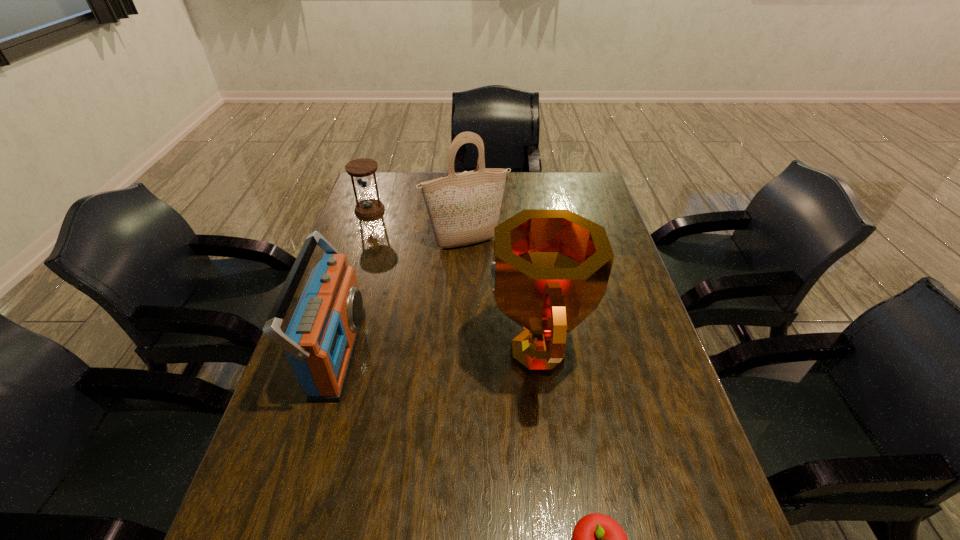
At what (x,y) coordinates should I click in order to perform the action: click on the fourth nearest object. Please return your answer as a coordinate pair (x, y). The image size is (960, 540). Looking at the image, I should click on (464, 208).

Identify the location of award. This screenshot has width=960, height=540. (550, 270).

Identify the location of radio receiver. (320, 340).

I want to click on the farthest object, so click(368, 207).

Locate an element on the screen. The width and height of the screenshot is (960, 540). the second shortest object is located at coordinates (368, 207).

I want to click on free spot located on the front of the second farthest object, so click(465, 272).

The width and height of the screenshot is (960, 540). I want to click on vacant space positioned on the side of the award with the star emblem, so click(x=347, y=352).

Where is `free space located on the side of the award with the star emblem`? free space located on the side of the award with the star emblem is located at coordinates (444, 352).

This screenshot has height=540, width=960. I want to click on vacant point located on the side of the award with the star emblem, so click(394, 352).

This screenshot has width=960, height=540. What are the coordinates of `blank area located 0.390m on the front-facing side of the radio receiver` in the screenshot? It's located at (512, 352).